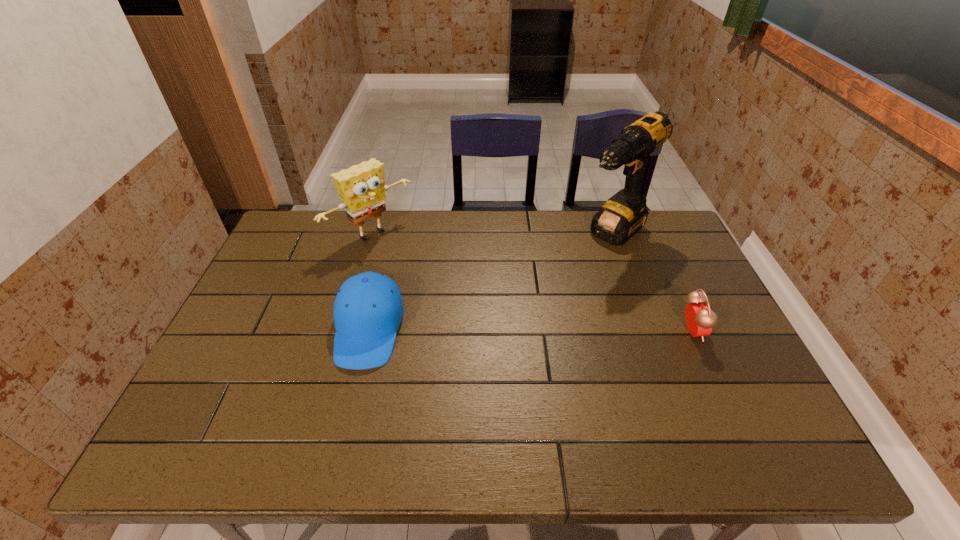
This screenshot has height=540, width=960. In order to click on free spot on the desktop that is between the cap and the alarm clock and is positioned on the face of the third shortest object in this screenshot , I will do `click(489, 330)`.

This screenshot has width=960, height=540. Find the location of `vacant spot on the desktop that is between the cap and the alarm clock and is positioned at the tip of the tallest object`. vacant spot on the desktop that is between the cap and the alarm clock and is positioned at the tip of the tallest object is located at coordinates (512, 330).